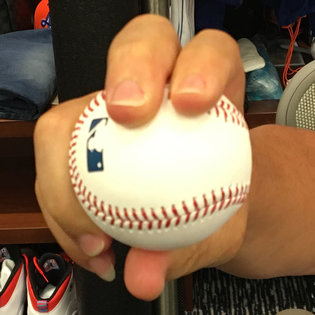
The image size is (315, 315). In order to click on carpet in this screenshot , I will do `click(229, 297)`.